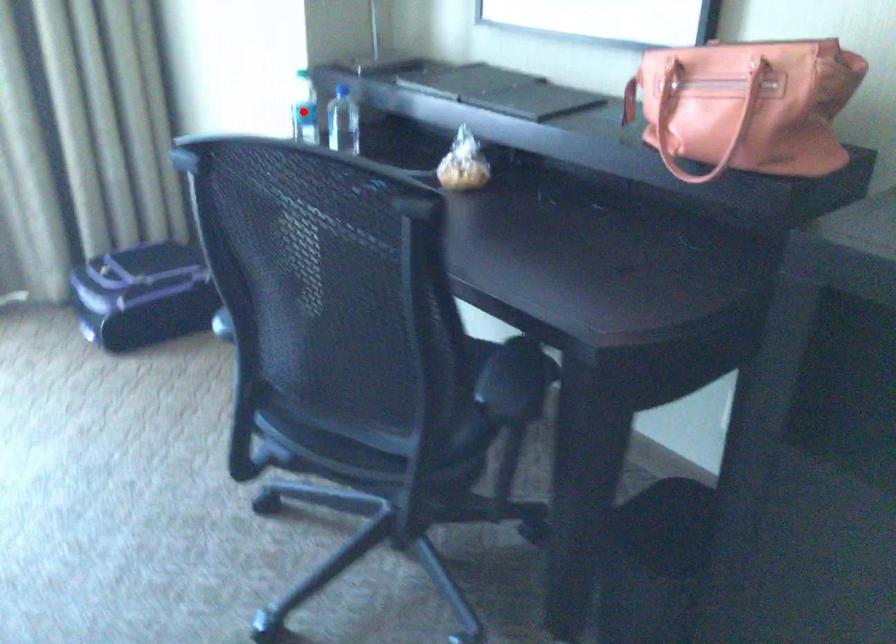
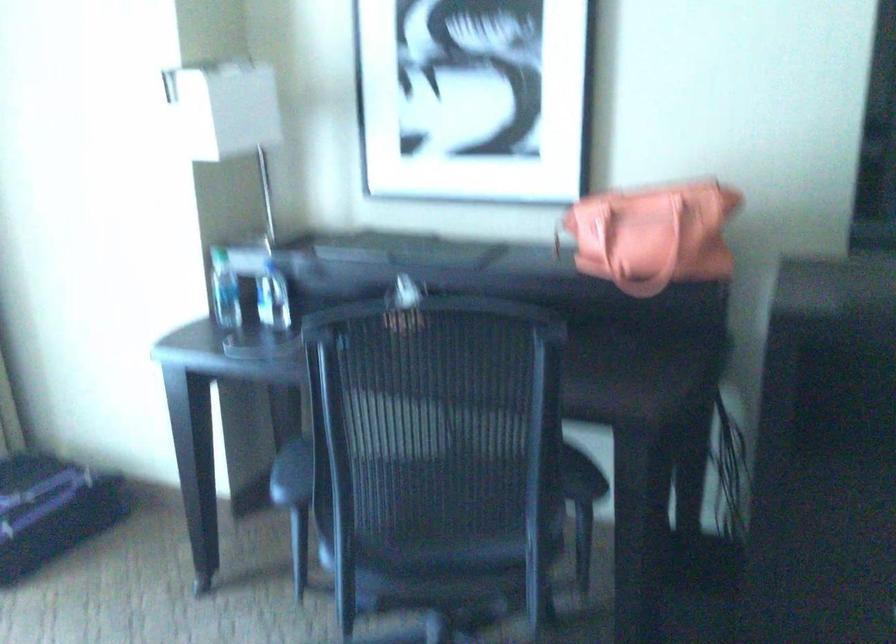
The point at the highlighted location is marked in the first image. Where is the corresponding point in the second image?

(225, 290)